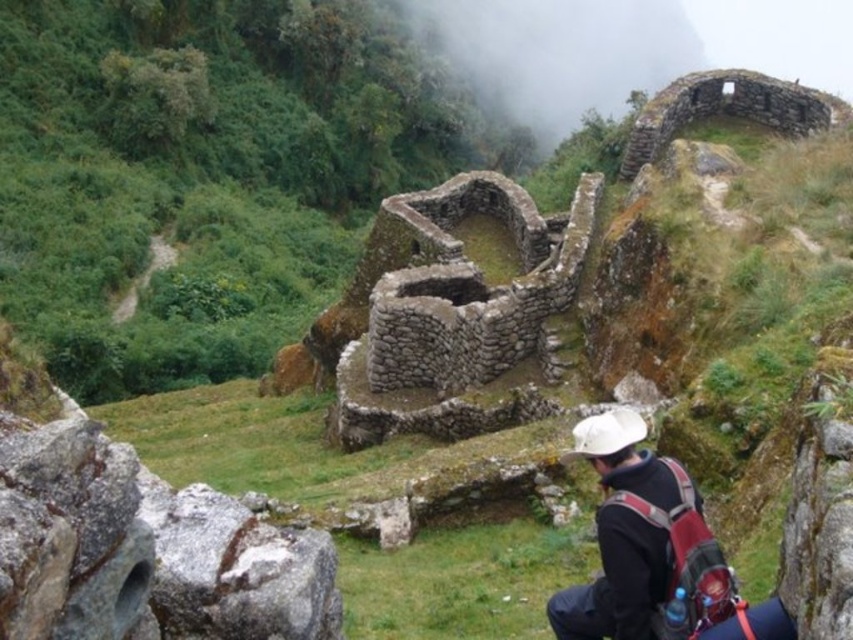
Question: Which point is farther to the camera?

Choices:
 (A) black fabric backpack at lower right
 (B) foggy stone wall at upper center

Answer: (B)

Question: Which of the following is the closest to the observer?

Choices:
 (A) black fabric backpack at lower right
 (B) foggy stone wall at upper center

Answer: (A)

Question: Is foggy stone wall at upper center bigger than black fabric backpack at lower right?

Choices:
 (A) no
 (B) yes

Answer: (B)

Question: Does foggy stone wall at upper center have a larger size compared to black fabric backpack at lower right?

Choices:
 (A) no
 (B) yes

Answer: (B)

Question: From the image, what is the correct spatial relationship of foggy stone wall at upper center in relation to black fabric backpack at lower right?

Choices:
 (A) left
 (B) right

Answer: (B)